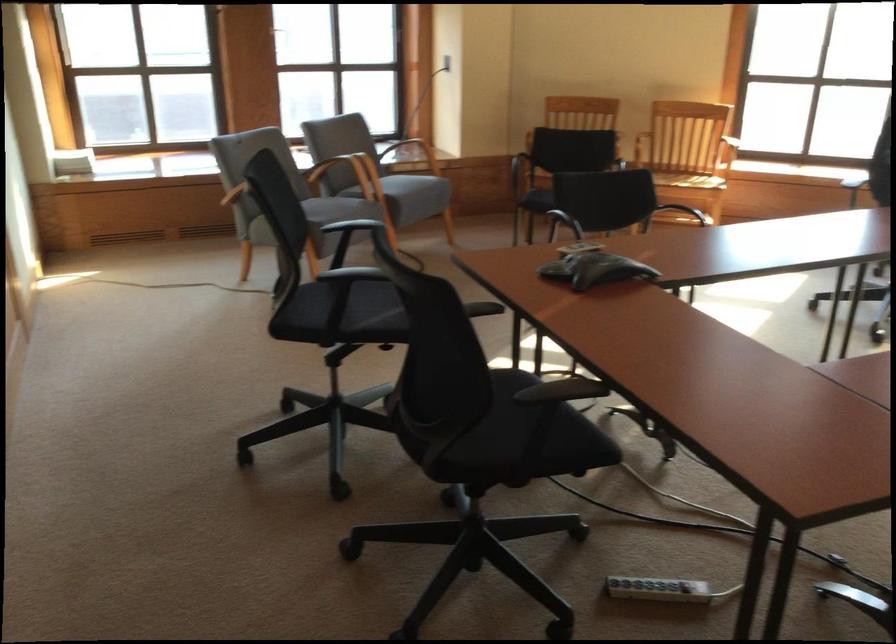
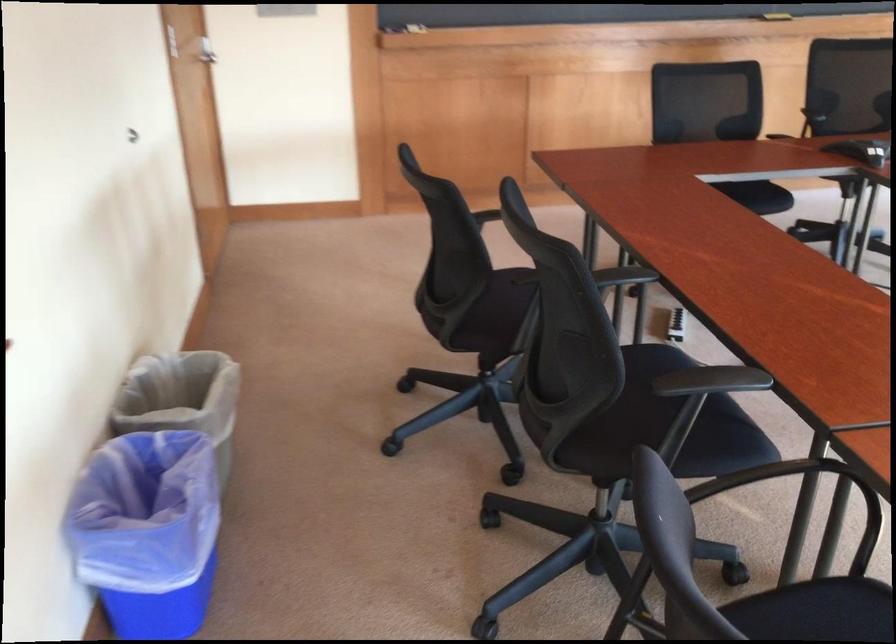
Question: I am providing you with two images of the same scene from different viewpoints. After the viewpoint changes to image2, which objects are now occluded?

Choices:
 (A) black chair sitting surface
 (B) grey trash can
 (C) blue pushpin
 (D) black chair armrest

Answer: (D)